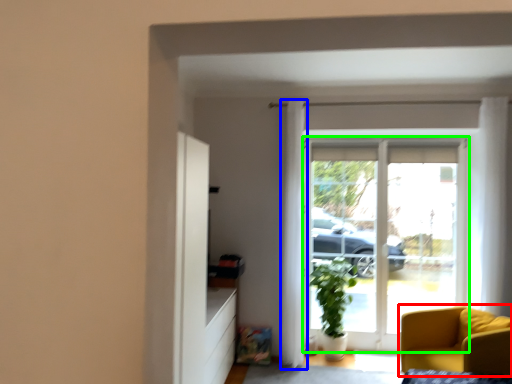
Question: Estimate the real-world distances between objects in this image. Which object is farther from chair (highlighted by a red box), curtain (highlighted by a blue box) or door (highlighted by a green box)?

Choices:
 (A) curtain
 (B) door

Answer: (A)